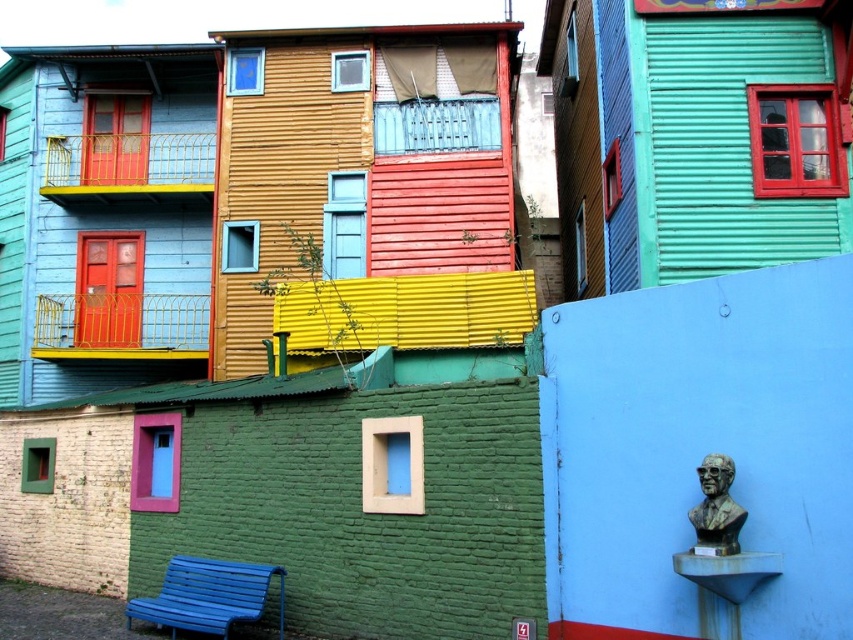
Can you confirm if blue painted wood bench at lower left is taller than bronze bust at right?

Correct, blue painted wood bench at lower left is much taller as bronze bust at right.

At what (x,y) coordinates should I click in order to perform the action: click on blue painted wood bench at lower left. Please return your answer as a coordinate pair (x, y). Image resolution: width=853 pixels, height=640 pixels. Looking at the image, I should click on (207, 595).

Locate an element on the screen. The image size is (853, 640). blue painted wood bench at lower left is located at coordinates (207, 595).